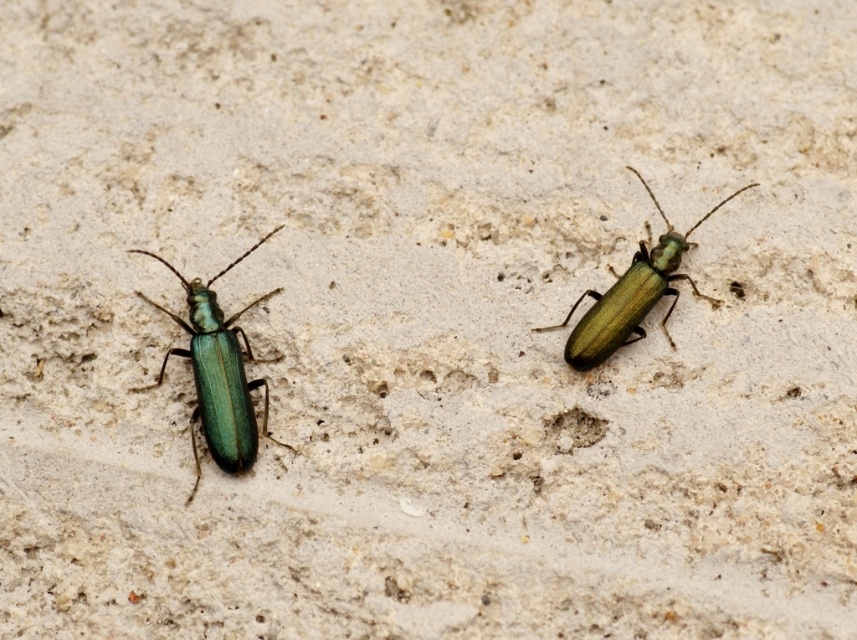
Question: Is metallic green beetle at left to the left of metallic green beetle at center-right from the viewer's perspective?

Choices:
 (A) no
 (B) yes

Answer: (B)

Question: From the image, what is the correct spatial relationship of metallic green beetle at left in relation to metallic green beetle at center-right?

Choices:
 (A) left
 (B) right

Answer: (A)

Question: Does metallic green beetle at left have a greater width compared to metallic green beetle at center-right?

Choices:
 (A) no
 (B) yes

Answer: (A)

Question: Which object appears farthest from the camera in this image?

Choices:
 (A) metallic green beetle at center-right
 (B) metallic green beetle at left

Answer: (A)